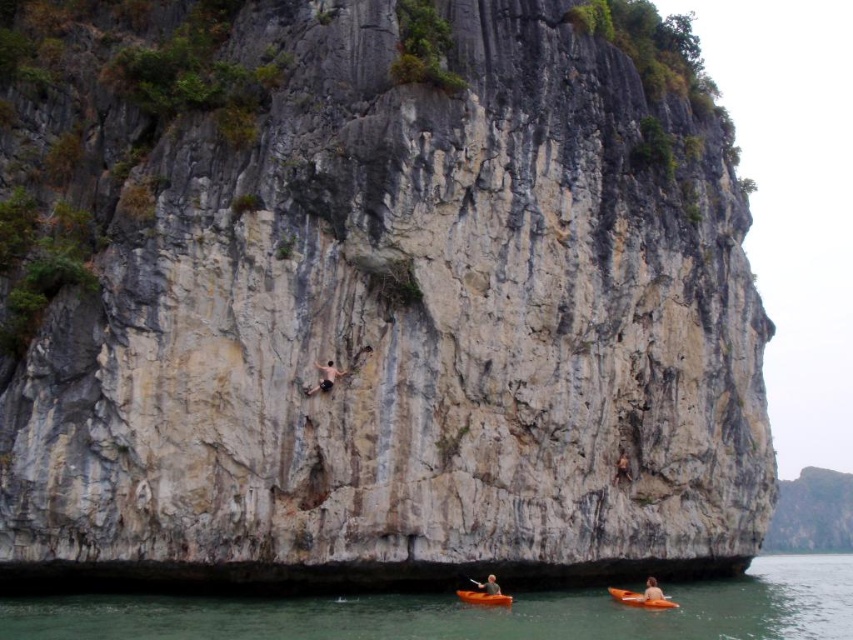
Question: Does orange plastic kayak at lower right have a larger size compared to orange plastic kayak at lower center?

Choices:
 (A) yes
 (B) no

Answer: (A)

Question: Which point is farther to the camera?

Choices:
 (A) (482, 588)
 (B) (647, 577)
 (C) (612, 588)
 (D) (483, 593)

Answer: (B)

Question: Is orange plastic paddle at lower right to the left of orange plastic kayak at lower center from the viewer's perspective?

Choices:
 (A) yes
 (B) no

Answer: (B)

Question: Which of the following is the farthest from the observer?

Choices:
 (A) (488, 573)
 (B) (492, 602)
 (C) (329, 371)
 (D) (627, 460)

Answer: (D)

Question: Can you confirm if orange plastic kayak at lower right is thinner than orange kayak at lower center?

Choices:
 (A) no
 (B) yes

Answer: (A)

Question: Which object is the farthest from the black plastic paddle at lower center?

Choices:
 (A) green water at lower center
 (B) orange kayak at lower center
 (C) orange plastic paddle at lower right

Answer: (A)